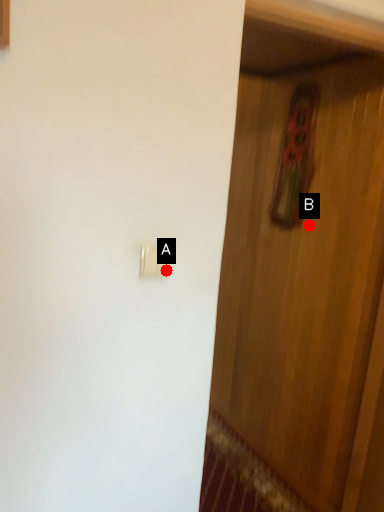
Question: Two points are circled on the image, labeled by A and B beside each circle. Which point appears farthest from the camera in this image?

Choices:
 (A) A is further
 (B) B is further

Answer: (B)